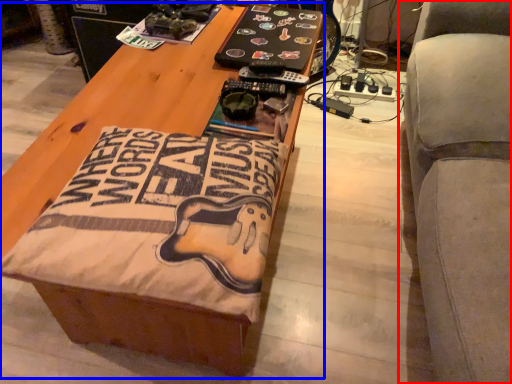
Question: Which of the following is the closest to the observer, furniture (highlighted by a red box) or table (highlighted by a blue box)?

Choices:
 (A) furniture
 (B) table

Answer: (A)